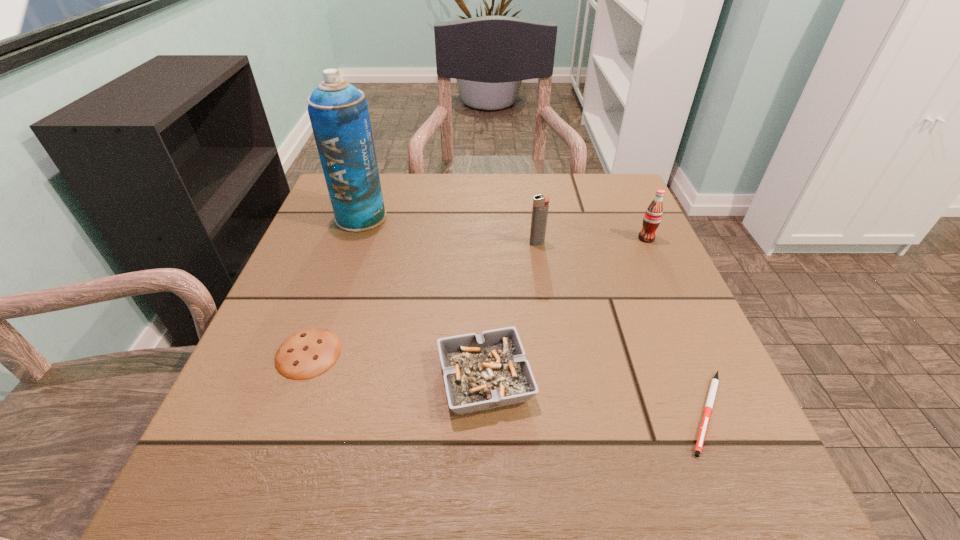
Locate an element on the screen. The height and width of the screenshot is (540, 960). blank space located 0.150m on the back of the fourth object from left to right is located at coordinates (531, 204).

Identify the location of free point located 0.230m on the left of the third object from left to right. (292, 380).

I want to click on vacant space located on the front of the cookie, so click(289, 408).

Locate an element on the screen. This screenshot has width=960, height=540. free region located on the clicker of the pen is located at coordinates (750, 512).

Image resolution: width=960 pixels, height=540 pixels. What are the coordinates of `object at the far edge` in the screenshot? It's located at (338, 111).

The image size is (960, 540). Identify the location of object positioned at the near edge. (714, 384).

Where is `aerosol can present at the left edge`? Image resolution: width=960 pixels, height=540 pixels. aerosol can present at the left edge is located at coordinates (338, 111).

The height and width of the screenshot is (540, 960). What are the coordinates of `cookie located in the left edge section of the desktop` in the screenshot? It's located at (306, 354).

Identify the location of soda that is at the right edge. (653, 215).

The width and height of the screenshot is (960, 540). In order to click on pen located in the right edge section of the desktop in this screenshot , I will do `click(714, 384)`.